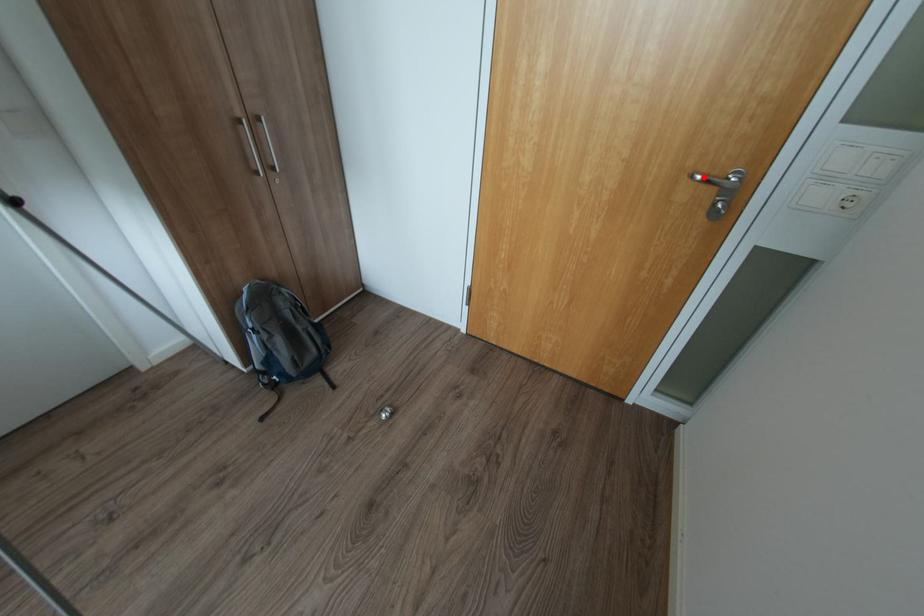
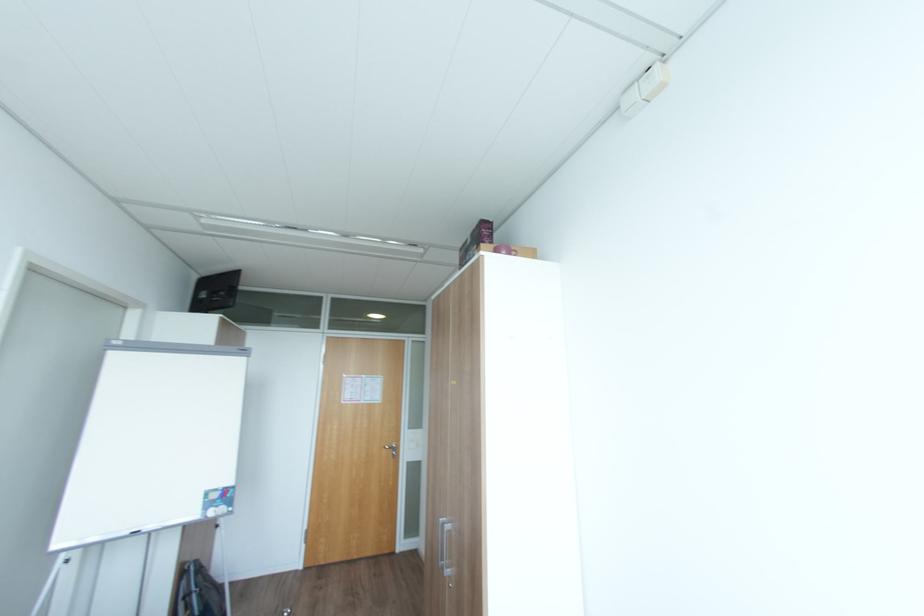
In the second image, find the point that corresponds to the highlighted location in the first image.

(392, 448)